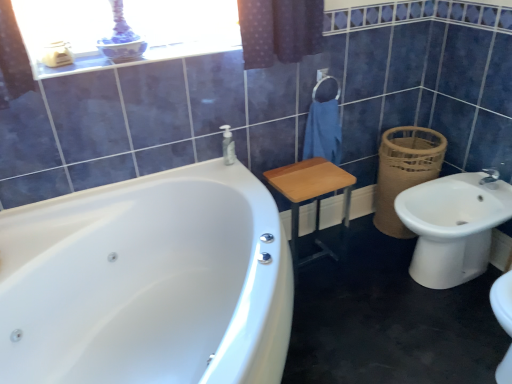
Where is `free space that is in between white glossy sink at lower right and wooden stool at center`? The width and height of the screenshot is (512, 384). free space that is in between white glossy sink at lower right and wooden stool at center is located at coordinates (362, 268).